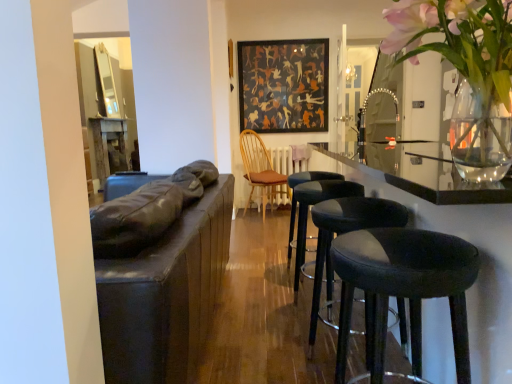
This screenshot has width=512, height=384. In order to click on vacant space that is to the left of black leather stool at center, marked as the 2th stool in a back-to-front arrangement in this screenshot , I will do `click(266, 310)`.